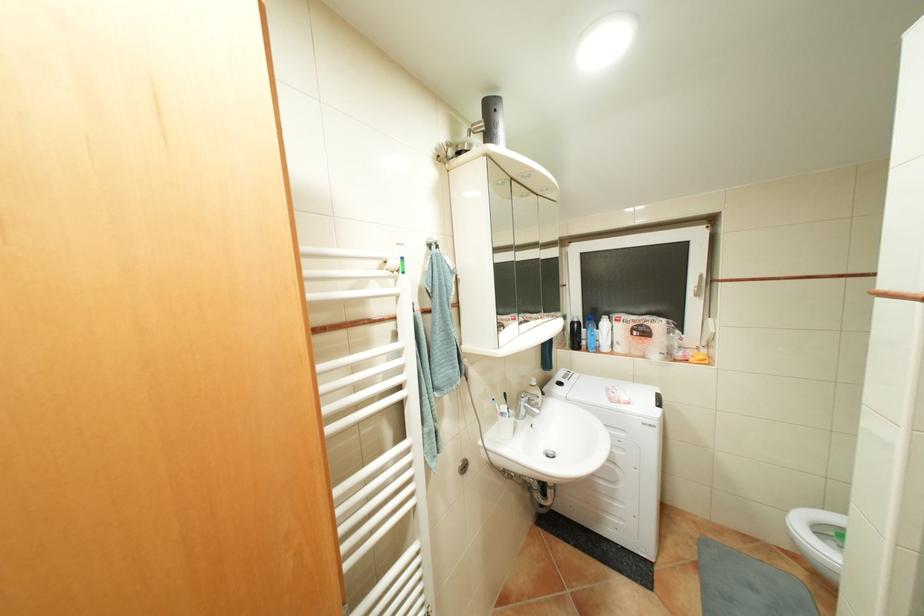
Identify the location of faucet handle. (528, 405).